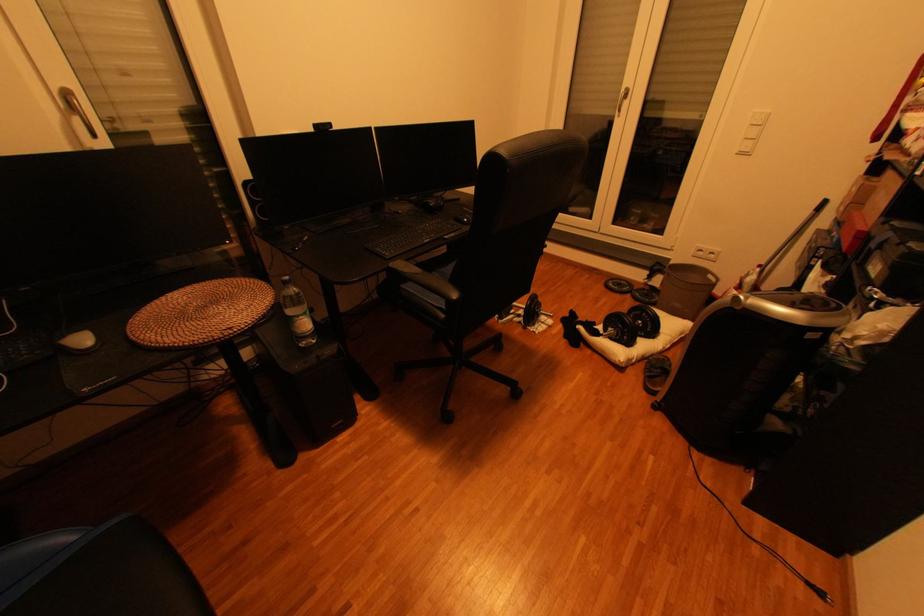
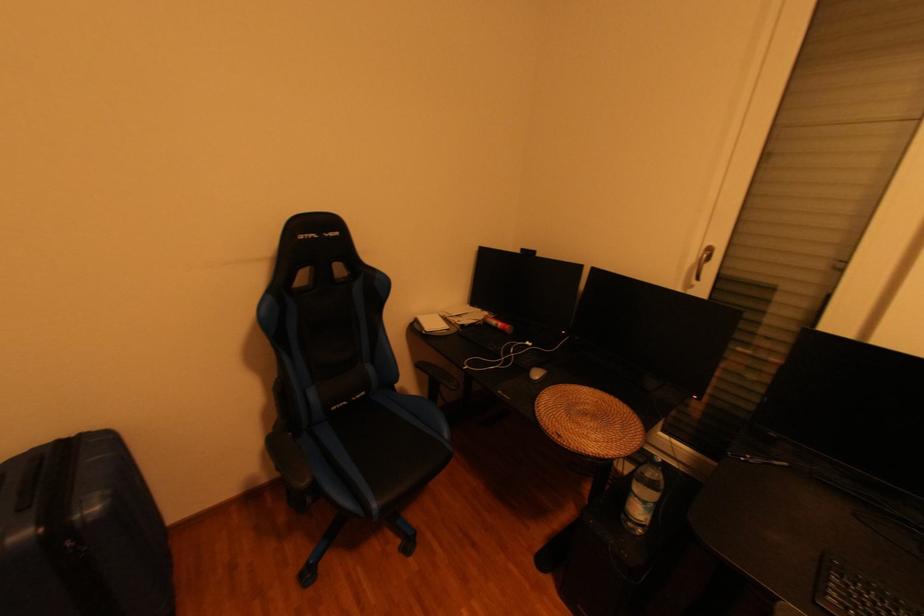
The images are taken continuously from a first-person perspective. In which direction is your viewpoint rotating?

The rotation direction of the camera is left-down.